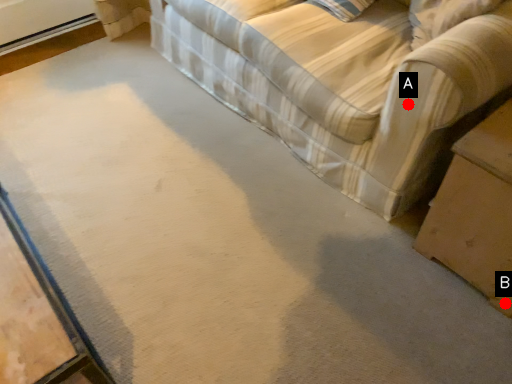
Question: Two points are circled on the image, labeled by A and B beside each circle. Which point is closer to the camera?

Choices:
 (A) A is closer
 (B) B is closer

Answer: (A)